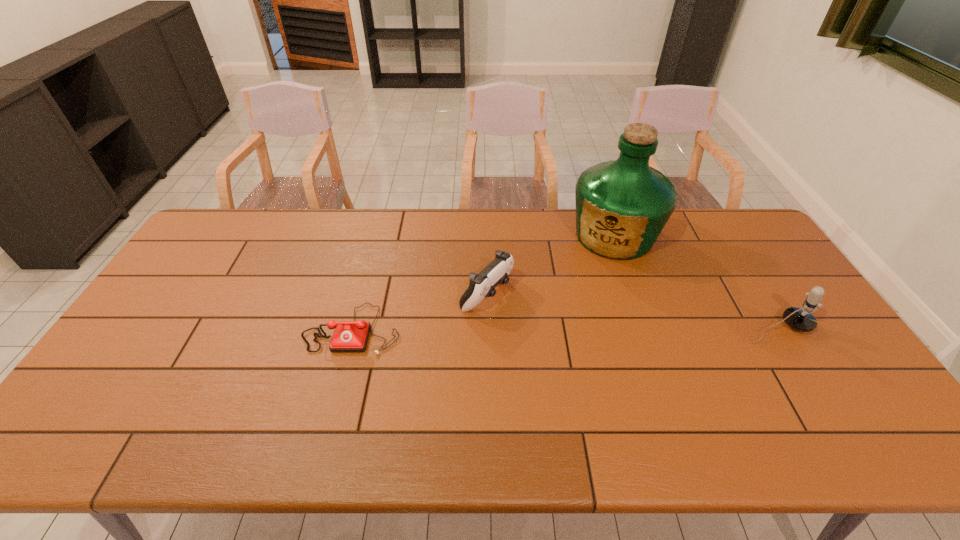
Locate an element on the screen. unoccupied position between the liquor and the microphone is located at coordinates (696, 282).

Point out which object is positioned as the nearest to the microphone. Please provide its 2D coordinates. Your answer should be formatted as a tuple, i.e. [(x, y)], where the tuple contains the x and y coordinates of a point satisfying the conditions above.

[(622, 206)]

Where is `object that is the third nearest to the rightmost object`? Image resolution: width=960 pixels, height=540 pixels. object that is the third nearest to the rightmost object is located at coordinates (349, 336).

The height and width of the screenshot is (540, 960). Find the location of `blank area in the image that satisfies the following two spatial constraints: 1. on the front side of the second object from right to left; 2. on the left side of the rightmost object`. blank area in the image that satisfies the following two spatial constraints: 1. on the front side of the second object from right to left; 2. on the left side of the rightmost object is located at coordinates (646, 328).